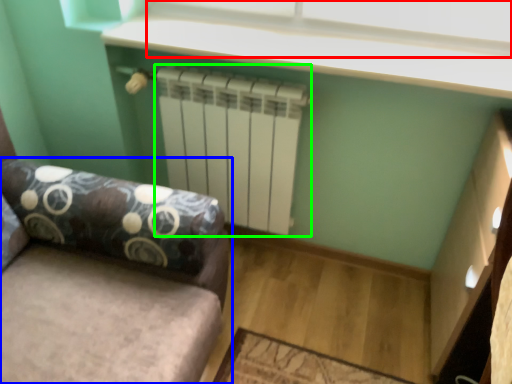
Question: Considering the real-world distances, which object is closest to window screen (highlighted by a red box)? studio couch (highlighted by a blue box) or radiator (highlighted by a green box).

Choices:
 (A) studio couch
 (B) radiator

Answer: (B)